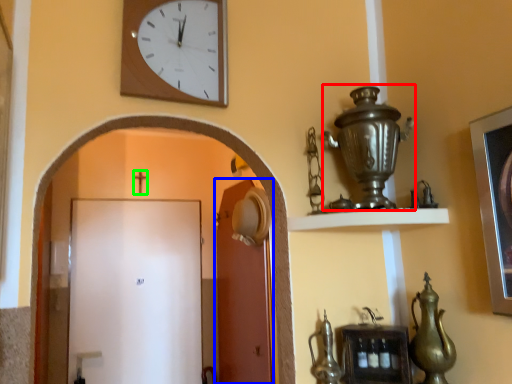
Question: Estimate the real-world distances between objects in this image. Which object is farther from candle holder (highlighted by a red box), door (highlighted by a blue box) or crucifix (highlighted by a green box)?

Choices:
 (A) door
 (B) crucifix

Answer: (B)